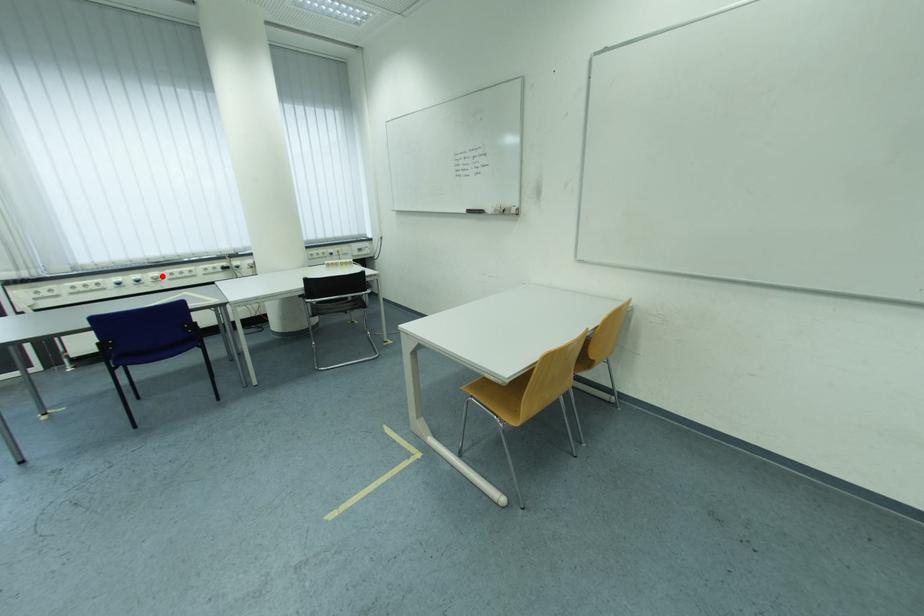
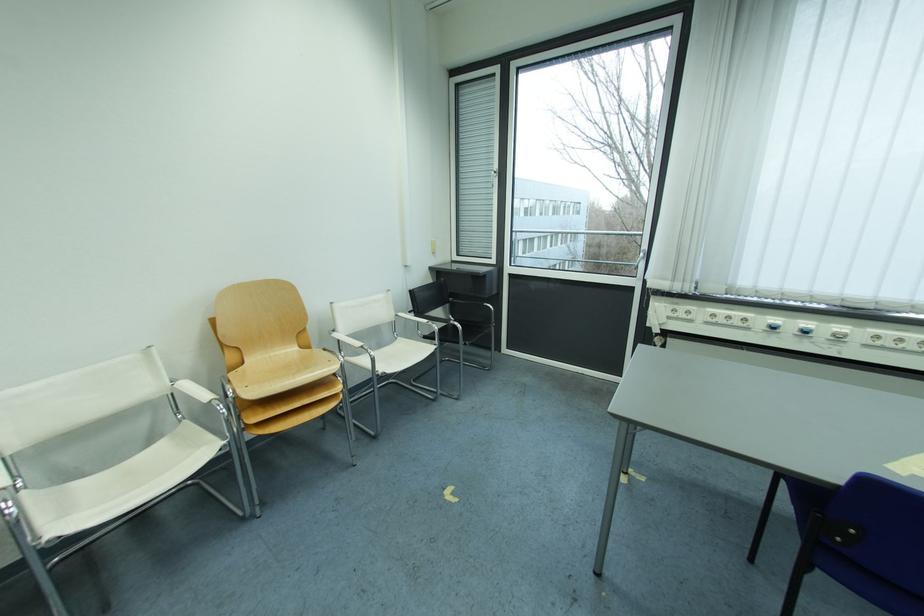
The point at the highlighted location is marked in the first image. Where is the corresponding point in the second image?

(849, 330)